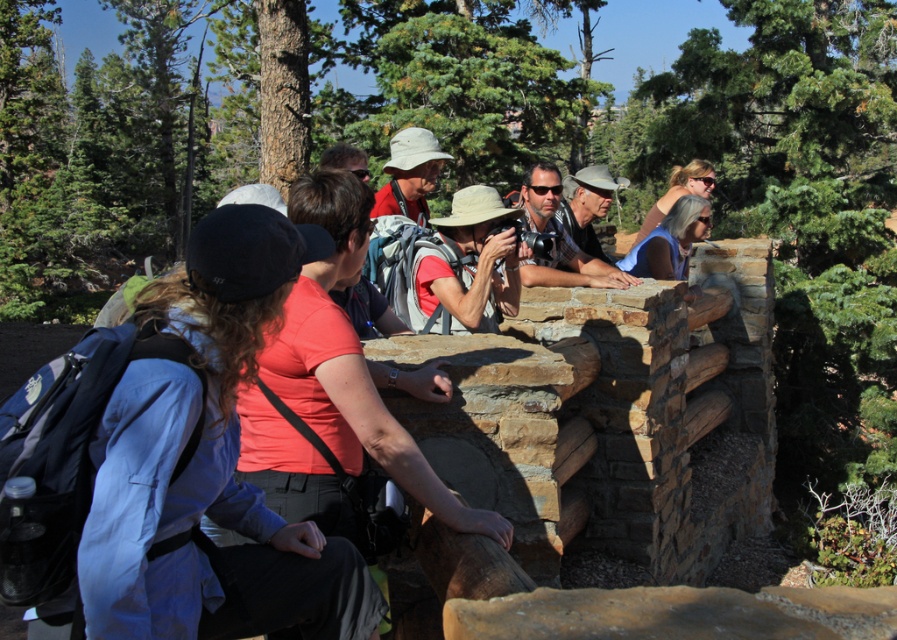
You are standing at the scenic overlook and want to take a photo of both the point at coordinates (549, 166) and the point at (415, 166). Which point is closer to you?

Point at coordinates (549, 166) is closer to you because it is further to the viewer than point at (415, 166).

You are a photographer trying to decide which item to place in the foreground of your composition. You have the matte black camera at center and the matte white hat at center. Which item should you choose if you want to emphasize size in your photo?

The matte black camera at center has a larger size compared to the matte white hat at center, so you should choose the matte black camera at center to emphasize size in your photo.